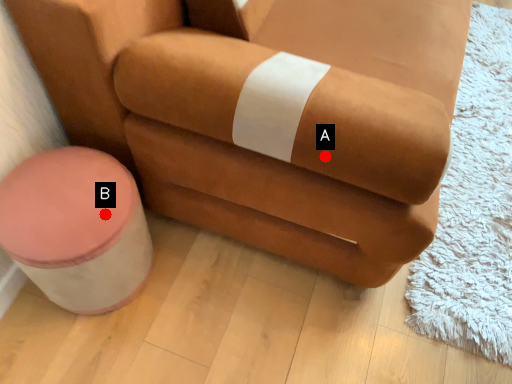
Question: Two points are circled on the image, labeled by A and B beside each circle. Which point is farther to the camera?

Choices:
 (A) A is further
 (B) B is further

Answer: (B)